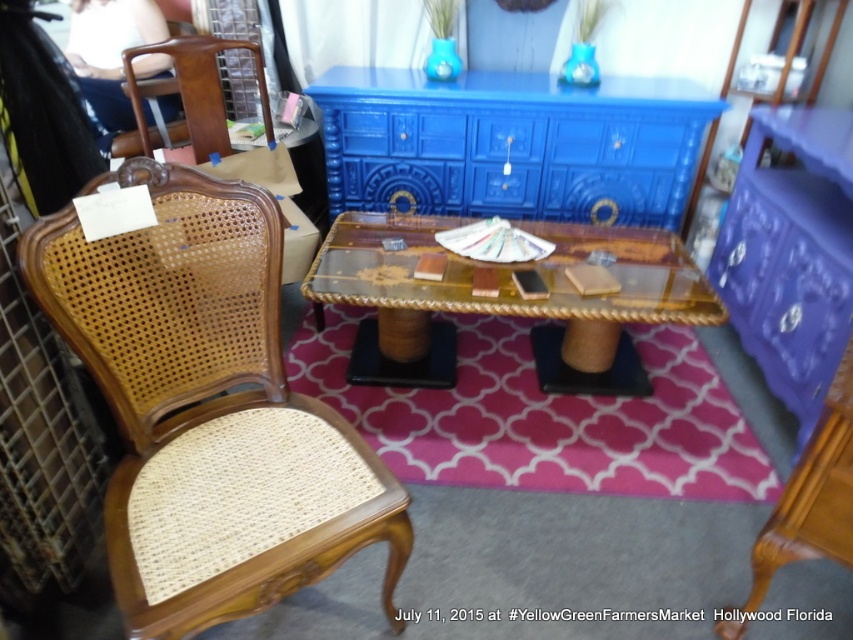
Question: Which is nearer to the wooden cane armchair at left?

Choices:
 (A) transparent acrylic table at center
 (B) blue painted wood dresser at upper center

Answer: (A)

Question: Which point is closer to the camera?

Choices:
 (A) (662, 260)
 (B) (686, 173)

Answer: (A)

Question: Can you confirm if blue painted wood dresser at upper center is positioned below transparent acrylic table at center?

Choices:
 (A) yes
 (B) no

Answer: (B)

Question: Does wooden cane armchair at left appear over purple glossy dresser at center?

Choices:
 (A) yes
 (B) no

Answer: (B)

Question: Can you confirm if blue painted wood dresser at upper center is wider than purple glossy dresser at center?

Choices:
 (A) no
 (B) yes

Answer: (B)

Question: Which of the following is the farthest from the observer?

Choices:
 (A) tap(527, 108)
 (B) tap(258, 298)
 (C) tap(341, 284)

Answer: (A)